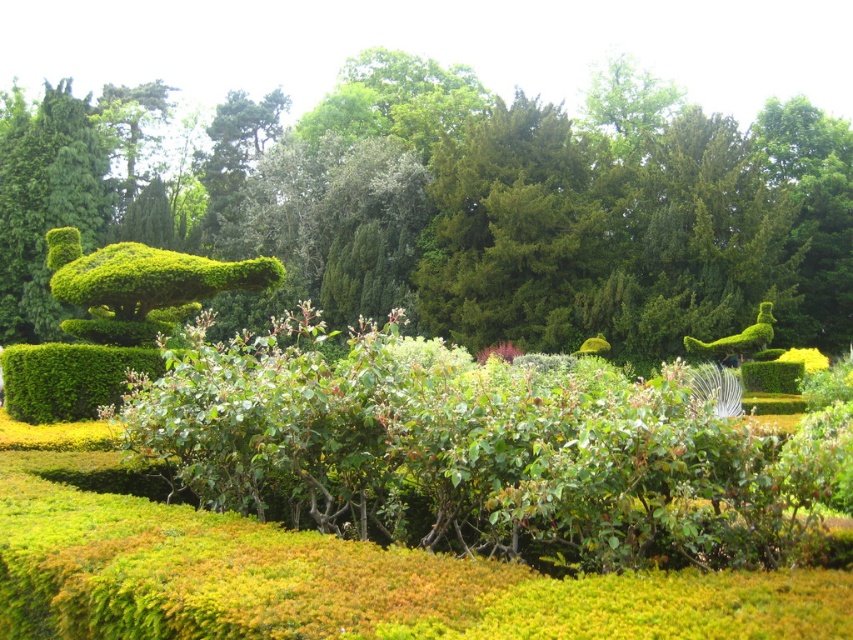
You are standing in the garden and want to reach a specific point marked at coordinates point (405,96). If your current position is 100 feet away from that point, how much further do you need to walk to reach it?

The distance of point (405,96) from viewer is 185.81 feet. Since you are already 100 feet away, you need to walk an additional 85.81 feet to reach it.